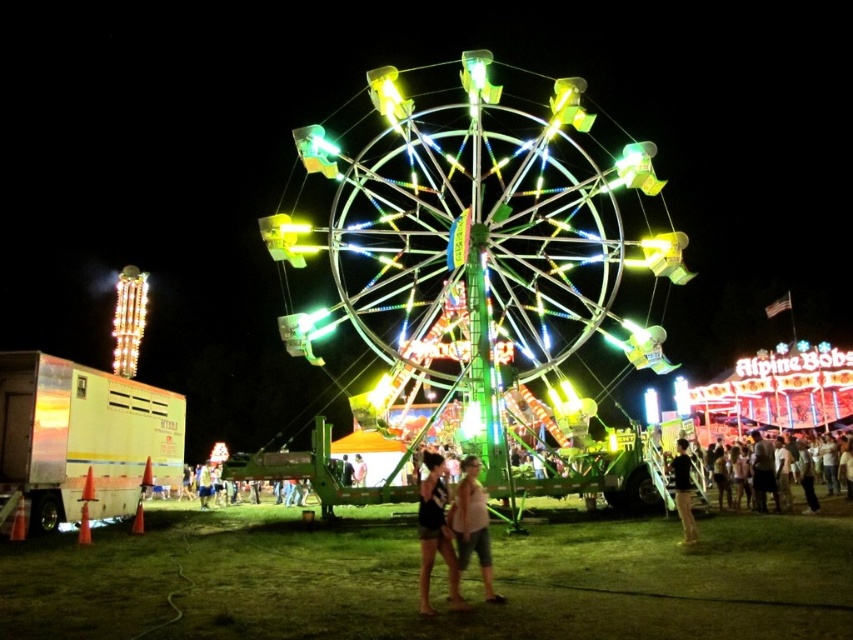
Question: Which point is farther to the camera?

Choices:
 (A) (646, 492)
 (B) (457, 484)
 (C) (685, 492)

Answer: (A)

Question: Is light brown fabric shorts at center further to the viewer compared to dark gray shirt at lower right?

Choices:
 (A) no
 (B) yes

Answer: (A)

Question: Is light brown fabric shorts at center bigger than metallic green ferris wheel at center?

Choices:
 (A) yes
 (B) no

Answer: (A)

Question: Does multicolored metallic ferris wheel at center appear on the right side of light brown fabric shorts at center?

Choices:
 (A) yes
 (B) no

Answer: (A)

Question: Which point is closer to the camera?

Choices:
 (A) dark gray shirt at lower right
 (B) light brown fabric shorts at center

Answer: (B)

Question: Among these objects, which one is nearest to the camera?

Choices:
 (A) light brown fabric shorts at center
 (B) green metallic ferris wheel at center
 (C) multicolored metallic ferris wheel at center

Answer: (A)